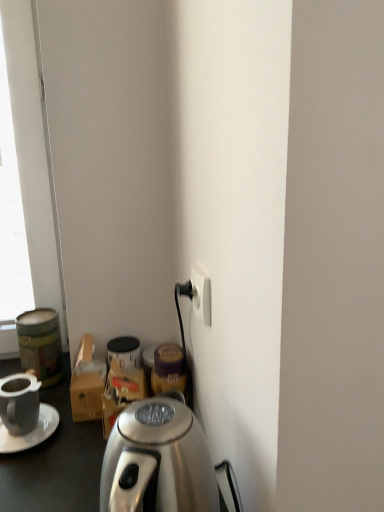
Question: From the image's perspective, is metallic green canister at left on matte black mug at lower left?

Choices:
 (A) no
 (B) yes

Answer: (B)

Question: Is metallic green canister at left positioned in front of matte black mug at lower left?

Choices:
 (A) no
 (B) yes

Answer: (A)

Question: Is metallic green canister at left outside matte black mug at lower left?

Choices:
 (A) yes
 (B) no

Answer: (A)

Question: Considering the relative sizes of metallic green canister at left and matte black mug at lower left in the image provided, is metallic green canister at left thinner than matte black mug at lower left?

Choices:
 (A) yes
 (B) no

Answer: (B)

Question: Does metallic green canister at left have a greater width compared to matte black mug at lower left?

Choices:
 (A) no
 (B) yes

Answer: (B)

Question: Is white plastic power outlet at lower right inside the boundaries of matte black mug at lower left, or outside?

Choices:
 (A) inside
 (B) outside

Answer: (B)

Question: In the image, is white plastic power outlet at lower right on the left side or the right side of matte black mug at lower left?

Choices:
 (A) left
 (B) right

Answer: (B)

Question: Considering their positions, is white plastic power outlet at lower right located in front of or behind matte black mug at lower left?

Choices:
 (A) front
 (B) behind

Answer: (A)

Question: From a real-world perspective, is white plastic power outlet at lower right physically located above or below matte black mug at lower left?

Choices:
 (A) below
 (B) above

Answer: (B)

Question: Is white plastic power outlet at lower right bigger or smaller than metallic green canister at left?

Choices:
 (A) big
 (B) small

Answer: (B)

Question: From their relative heights in the image, would you say white plastic power outlet at lower right is taller or shorter than metallic green canister at left?

Choices:
 (A) tall
 (B) short

Answer: (B)

Question: From the image's perspective, is white plastic power outlet at lower right located above or below metallic green canister at left?

Choices:
 (A) below
 (B) above

Answer: (B)

Question: Is white plastic power outlet at lower right in front of or behind metallic green canister at left in the image?

Choices:
 (A) behind
 (B) front

Answer: (B)

Question: In terms of width, does white plastic power outlet at lower right look wider or thinner when compared to white matte saucer at left?

Choices:
 (A) thin
 (B) wide

Answer: (A)

Question: From a real-world perspective, is white plastic power outlet at lower right above or below white matte saucer at left?

Choices:
 (A) below
 (B) above

Answer: (B)